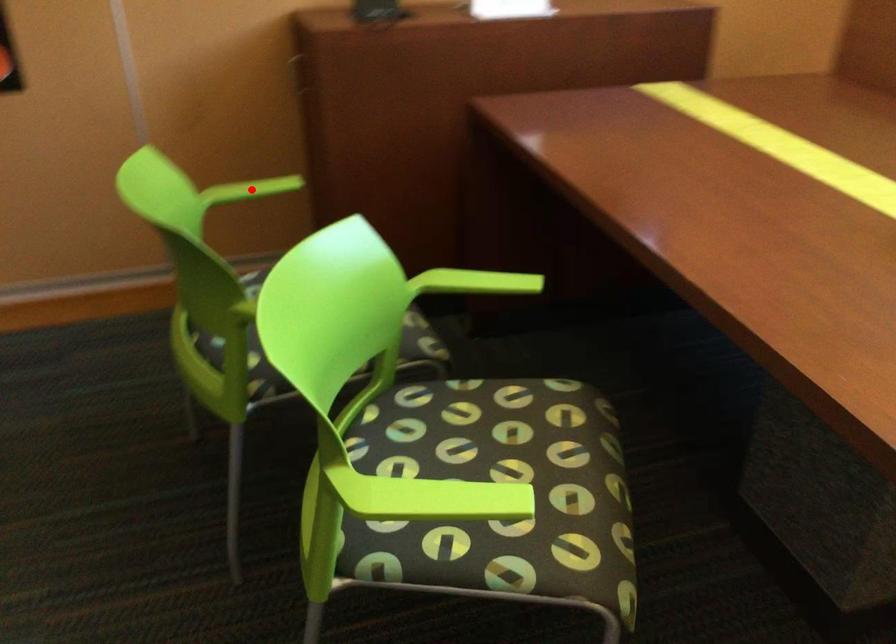
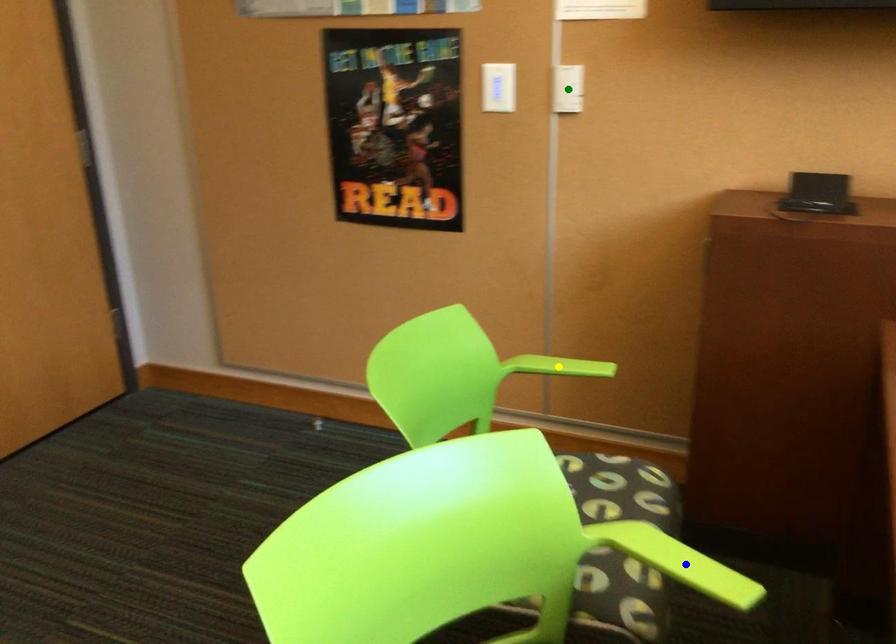
Question: I am providing you with two images of the same scene from different viewpoints. A red point is marked on the first image. You are given multiple points on the second image. Which point in image 2 is actually the same real-world point as the red point in image 1?

Choices:
 (A) blue point
 (B) green point
 (C) yellow point

Answer: (C)